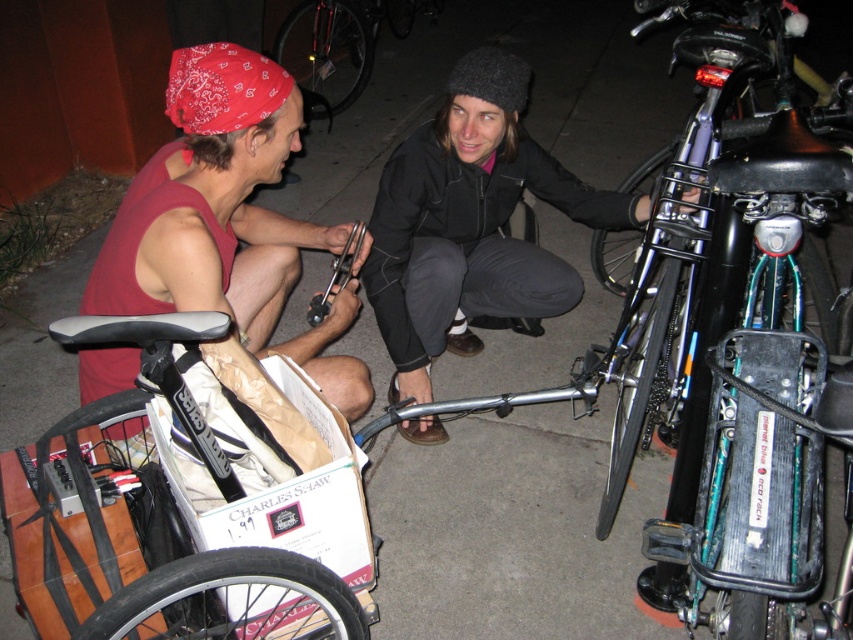
Question: Which of these objects is positioned closest to the wooden bicycle at lower left?

Choices:
 (A) matte red bandana at left
 (B) black matte bicycle at center

Answer: (A)

Question: Considering the relative positions of wooden bicycle at lower left and matte red bandana at left in the image provided, where is wooden bicycle at lower left located with respect to matte red bandana at left?

Choices:
 (A) above
 (B) below

Answer: (B)

Question: Which of the following is the closest to the observer?

Choices:
 (A) (173, 234)
 (B) (529, 296)
 (C) (57, 634)

Answer: (C)

Question: Among these points, which one is nearest to the camera?

Choices:
 (A) (315, 419)
 (B) (552, 282)
 (C) (199, 102)

Answer: (A)

Question: Does matte red bandana at left lie in front of black matte bicycle at center?

Choices:
 (A) yes
 (B) no

Answer: (A)

Question: Where is wooden bicycle at lower left located in relation to black matte bicycle at center in the image?

Choices:
 (A) above
 (B) below

Answer: (B)